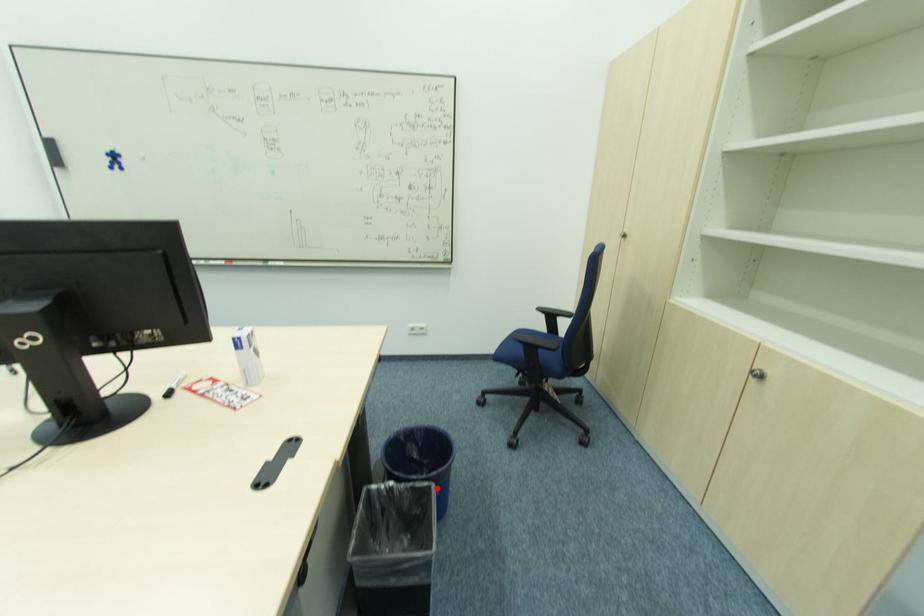
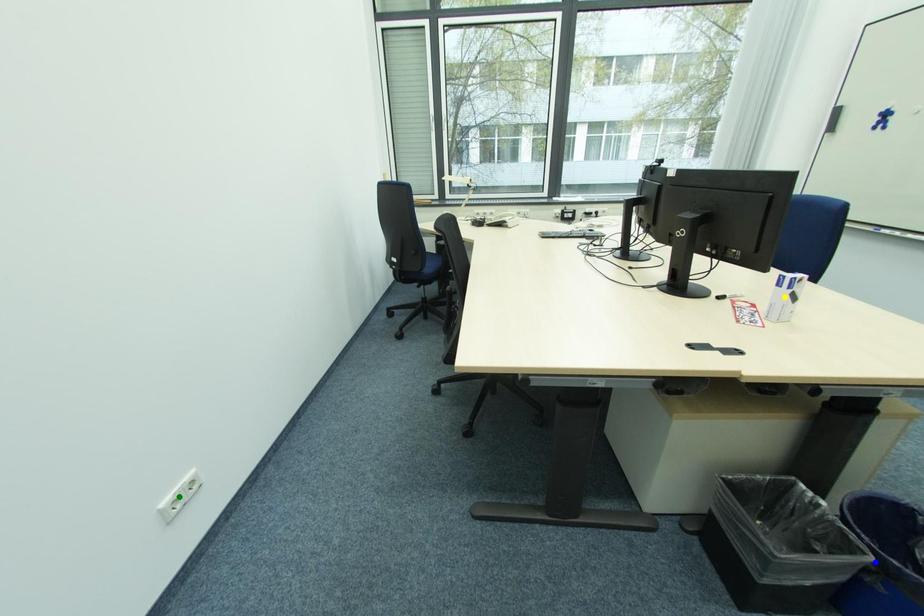
Question: I am providing you with two images of the same scene from different viewpoints. A red point is marked on the first image. You are given multiple points on the second image. Which point in image 2 represents the same 3d spot as the red point in image 1?

Choices:
 (A) yellow point
 (B) blue point
 (C) green point

Answer: (B)